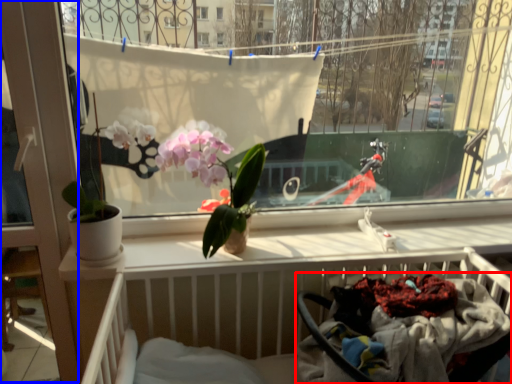
Question: Which of the following is the closest to the observer, baby carriage (highlighted by a red box) or screen door (highlighted by a blue box)?

Choices:
 (A) baby carriage
 (B) screen door

Answer: (A)